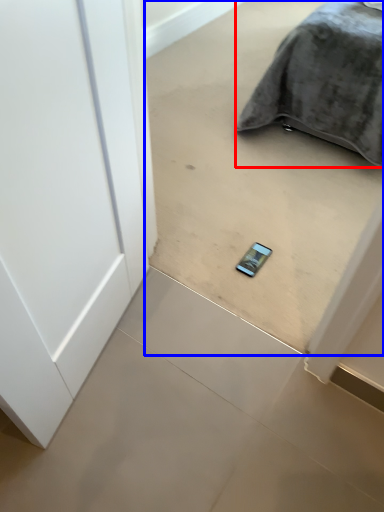
Question: Which of the following is the farthest to the observer, furniture (highlighted by a red box) or concrete (highlighted by a blue box)?

Choices:
 (A) furniture
 (B) concrete

Answer: (A)